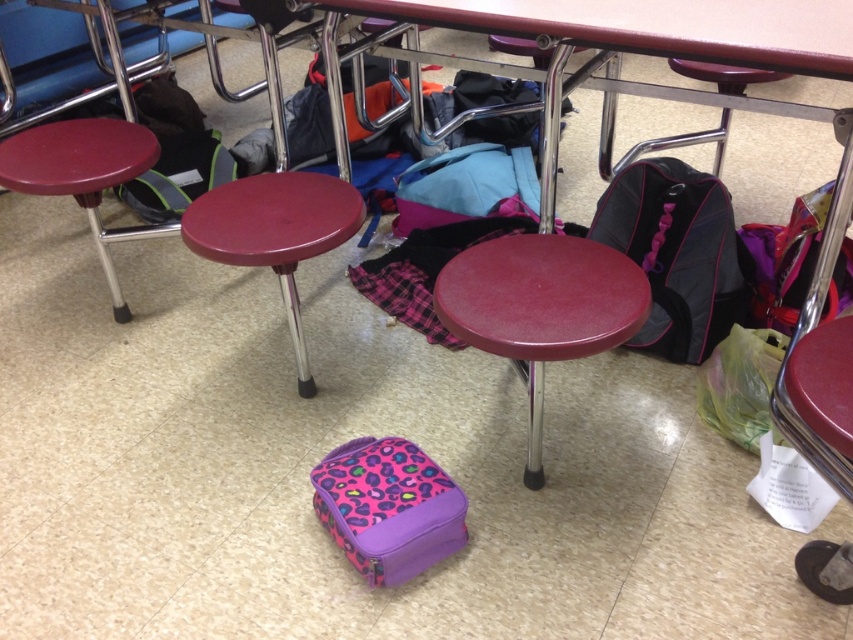
Can you confirm if maroon plastic stool at center is bigger than matte blue backpack at center?

Yes.

Which of these two, maroon plastic stool at center or matte blue backpack at center, stands shorter?

Standing shorter between the two is matte blue backpack at center.

The image size is (853, 640). Find the location of `maroon plastic stool at center`. maroon plastic stool at center is located at coordinates (276, 232).

I want to click on maroon plastic stool at center, so click(x=276, y=232).

Does purple leopard print lunchbox at center come in front of maroon plastic stool at center?

Yes, purple leopard print lunchbox at center is in front of maroon plastic stool at center.

Is point (323, 520) farther from camera compared to point (200, 196)?

No, it is not.

Where is `purple leopard print lunchbox at center`? purple leopard print lunchbox at center is located at coordinates (387, 508).

Can you confirm if black fabric backpack at lower right is positioned to the right of matte blue backpack at center?

Yes, black fabric backpack at lower right is to the right of matte blue backpack at center.

Can you confirm if black fabric backpack at lower right is positioned above matte blue backpack at center?

No.

Is point (692, 340) closer to camera compared to point (515, 150)?

Yes, point (692, 340) is closer to viewer.

Find the location of a particular element. The width and height of the screenshot is (853, 640). black fabric backpack at lower right is located at coordinates [x=676, y=253].